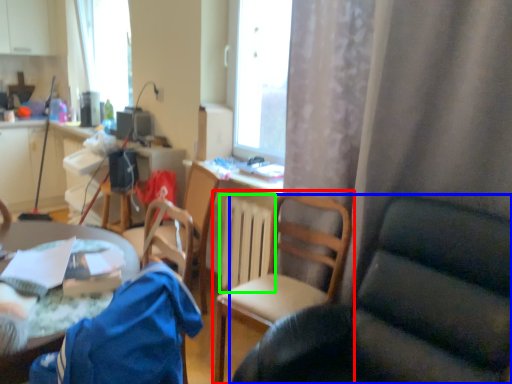
Question: Considering the real-world distances, which object is farthest from chair (highlighted by a red box)? chair (highlighted by a blue box) or radiator (highlighted by a green box)?

Choices:
 (A) chair
 (B) radiator

Answer: (A)